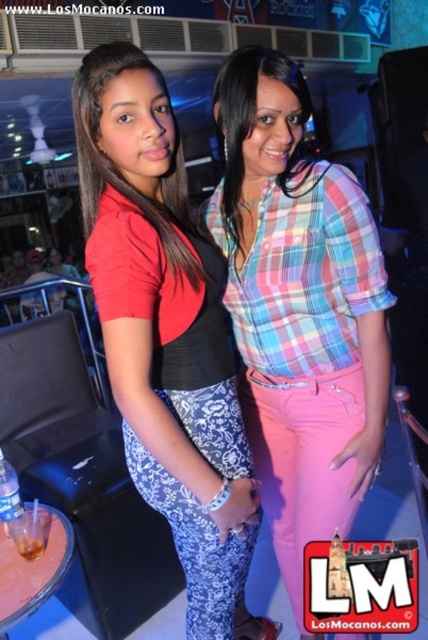
Does plaid fabric shirt at center have a larger size compared to matte black top at center?

No, plaid fabric shirt at center is not bigger than matte black top at center.

How distant is plaid fabric shirt at center from matte black top at center?

plaid fabric shirt at center and matte black top at center are 8.74 inches apart from each other.

Which is in front, point (294, 531) or point (86, 250)?

Point (86, 250) is more forward.

Where is `plaid fabric shirt at center`? The width and height of the screenshot is (428, 640). plaid fabric shirt at center is located at coordinates (299, 308).